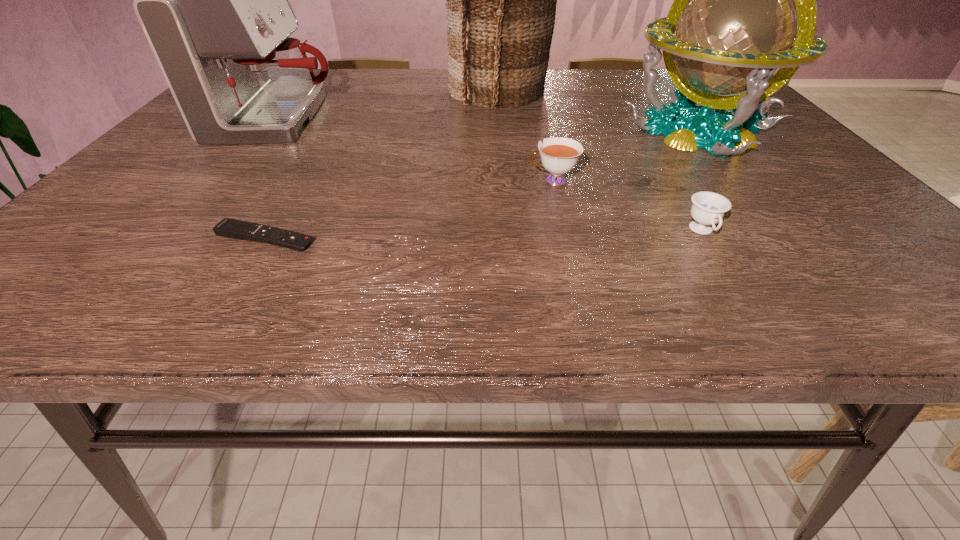
At what (x,y) coordinates should I click in order to perform the action: click on free area in between the nearer teacup and the fourth farthest object. Please return your answer as a coordinate pair (x, y). The width and height of the screenshot is (960, 540). Looking at the image, I should click on (628, 206).

Locate an element on the screen. This screenshot has height=540, width=960. blank region between the fifth shortest object and the tallest object is located at coordinates (599, 110).

Image resolution: width=960 pixels, height=540 pixels. I want to click on free area in between the tallest object and the second tallest object, so click(599, 110).

The height and width of the screenshot is (540, 960). I want to click on free spot between the farther teacup and the fourth shortest object, so click(x=417, y=150).

Locate an element on the screen. Image resolution: width=960 pixels, height=540 pixels. empty location between the shortest object and the basket is located at coordinates (382, 164).

Locate an element on the screen. The height and width of the screenshot is (540, 960). object that is the second closest one to the shortest object is located at coordinates (559, 155).

Identify the location of the third closest object relative to the shortest object. The height and width of the screenshot is (540, 960). (501, 0).

Identify the location of blank area in the image that satisfies the following two spatial constraints: 1. on the front of the third tallest object near the spout; 2. on the left side of the remote control. This screenshot has height=540, width=960. (185, 238).

Identify the location of blank area in the image that satisfies the following two spatial constraints: 1. on the back side of the basket; 2. on the left side of the shortest object. [x=350, y=90].

Locate an element on the screen. free space that satisfies the following two spatial constraints: 1. on the front of the remote control near the spout; 2. on the left side of the coffee maker is located at coordinates (185, 238).